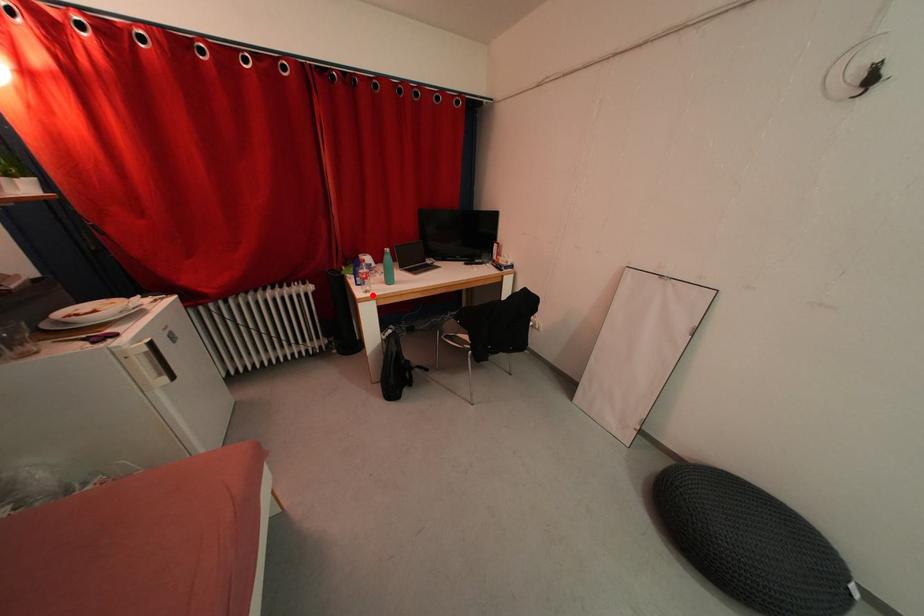
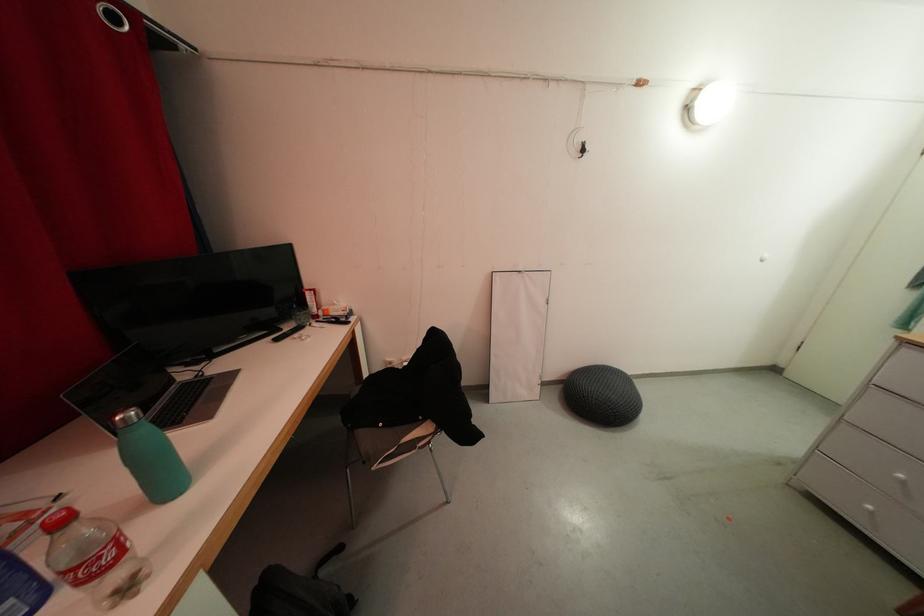
Where in the second image is the point corresponding to the highlighted location from the first image?

(134, 593)